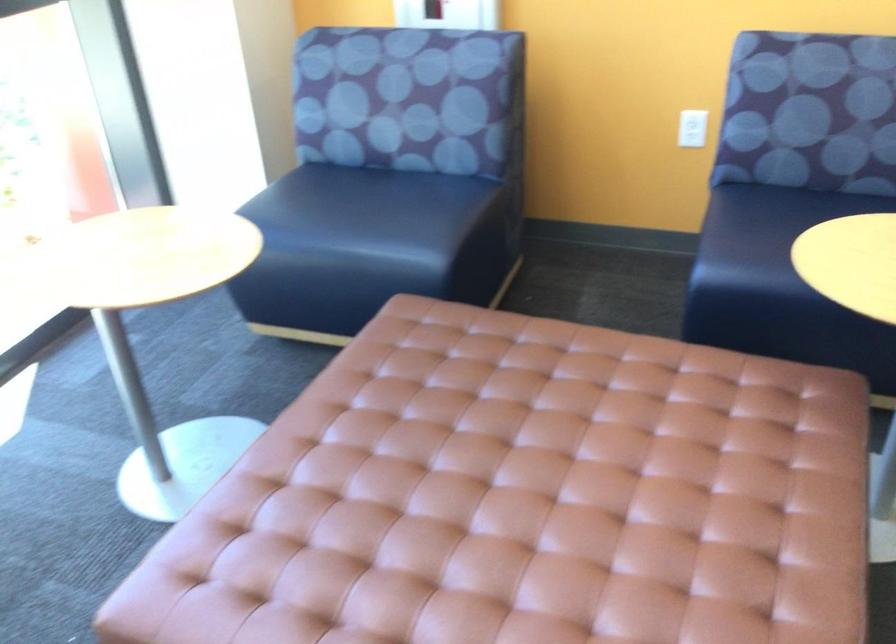
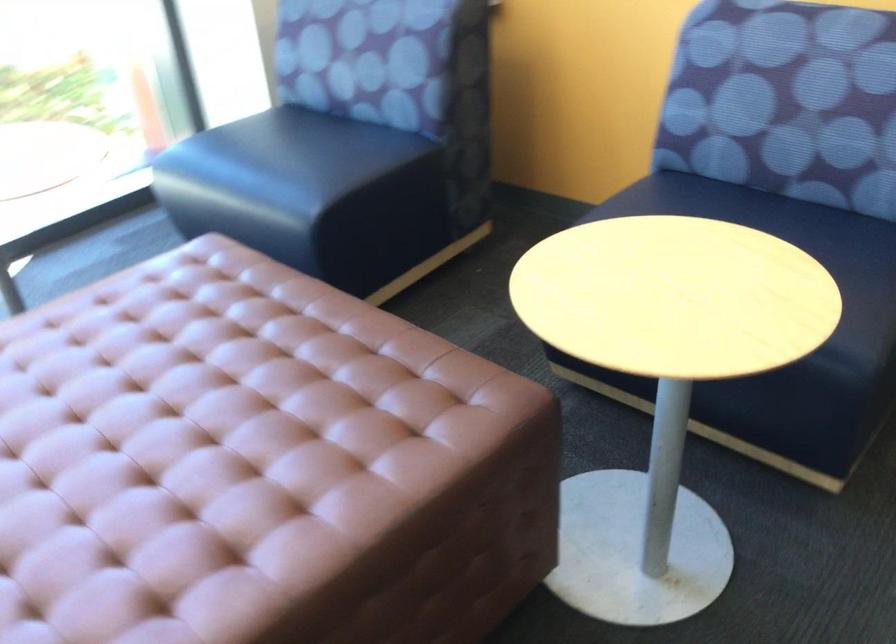
Question: Based on the continuous images, in which direction is the camera rotating? Reply with the corresponding letter.

Choices:
 (A) Left
 (B) Right
 (C) Up
 (D) Down

Answer: (A)